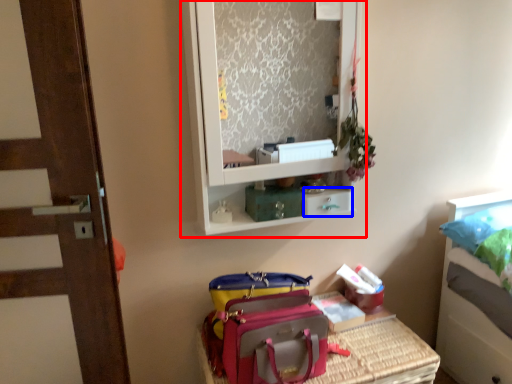
Question: Which object is closer to the camera taking this photo, medicine cabinet (highlighted by a red box) or drawer (highlighted by a blue box)?

Choices:
 (A) medicine cabinet
 (B) drawer

Answer: (A)